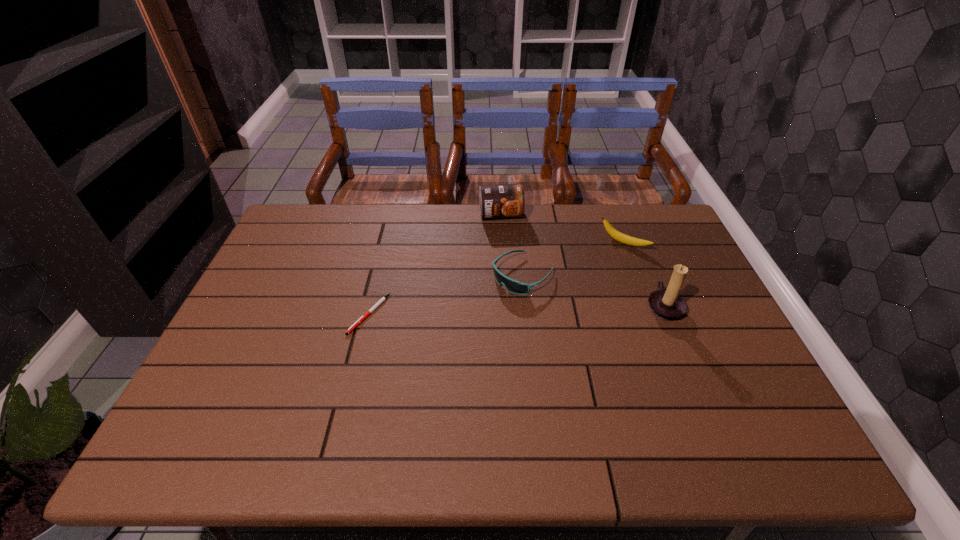
Locate an element on the screen. The image size is (960, 540). vacant space on the desktop that is between the pen and the tallest object and is positioned on the upward curve of the banana is located at coordinates (559, 309).

Find the location of a particular element. The image size is (960, 540). free spot on the desktop that is between the leftmost object and the candle holder and is positioned on the front-facing side of the sunglasses is located at coordinates (474, 312).

Image resolution: width=960 pixels, height=540 pixels. Identify the location of vacant space on the desktop that is between the leftmost object and the tallest object and is positioned on the front label of the fourth shortest object. (521, 310).